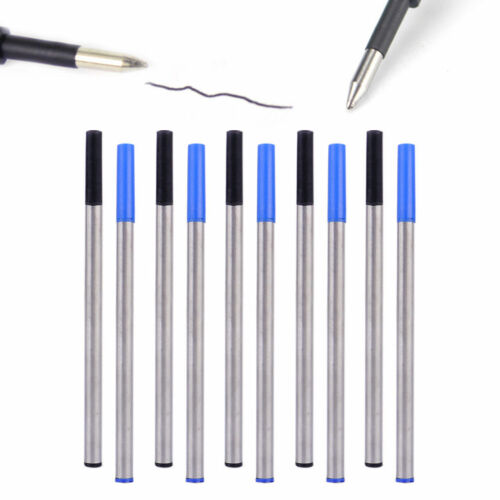
Locate an element on the screen. pens with blue lids is located at coordinates (126, 185), (197, 189), (269, 191), (336, 196), (404, 201).